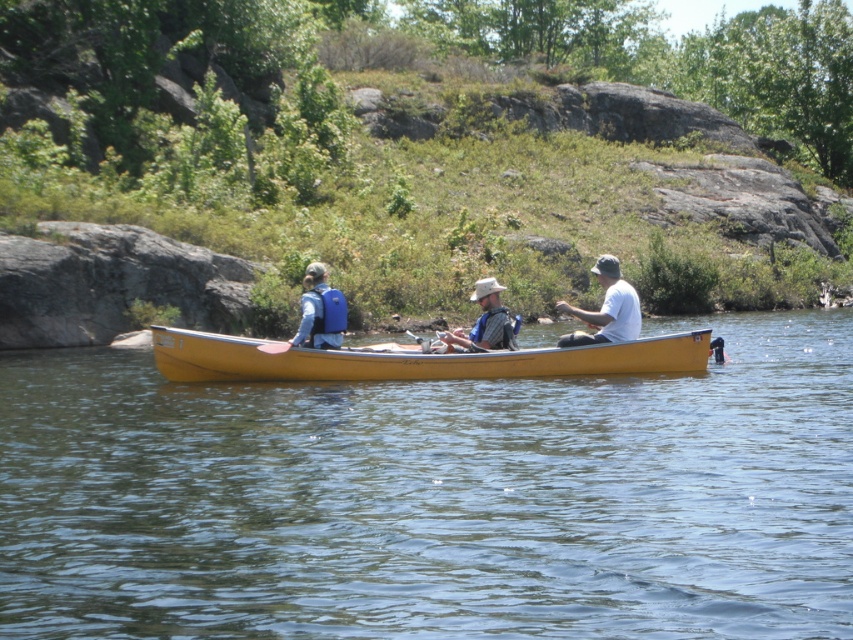
Question: Does yellow wood boat at center have a greater width compared to blue fabric life vest at center?

Choices:
 (A) no
 (B) yes

Answer: (B)

Question: Can you confirm if white matte shirt at center is smaller than blue fabric life vest at center?

Choices:
 (A) no
 (B) yes

Answer: (A)

Question: Which of the following is the farthest from the observer?

Choices:
 (A) yellow wood boat at center
 (B) blue fabric life vest at center

Answer: (B)

Question: Which object is closer to the camera taking this photo?

Choices:
 (A) blue fabric life vest at center
 (B) matte blue life vest at center
 (C) yellow wood canoe at center

Answer: (B)

Question: Can you confirm if yellow wood boat at center is positioned above white matte shirt at center?

Choices:
 (A) yes
 (B) no

Answer: (B)

Question: Which of these objects is positioned farthest from the yellow wood boat at center?

Choices:
 (A) matte gray hat at center
 (B) matte blue life vest at center
 (C) blue fabric life vest at center

Answer: (C)